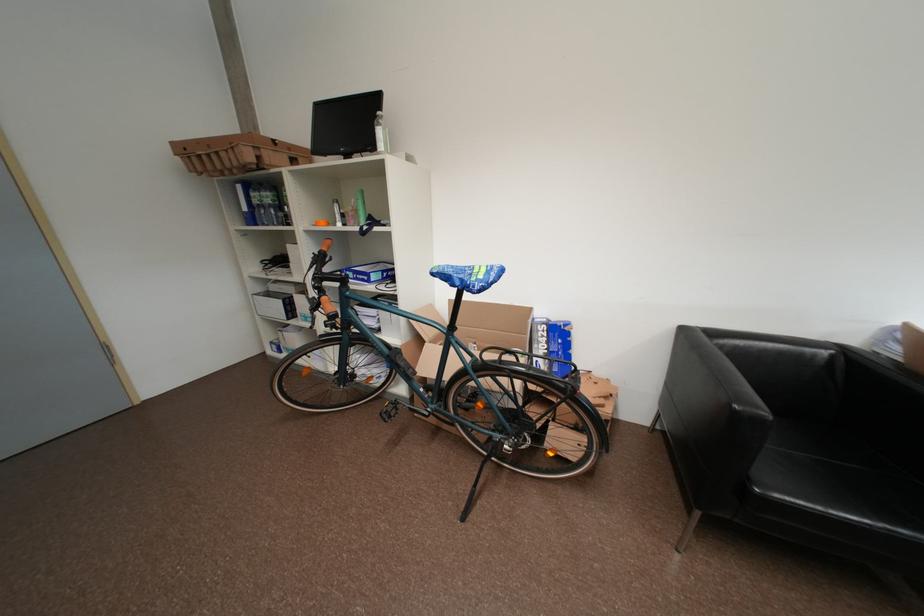
Image resolution: width=924 pixels, height=616 pixels. Describe the element at coordinates (832, 448) in the screenshot. I see `the chair sitting surface` at that location.